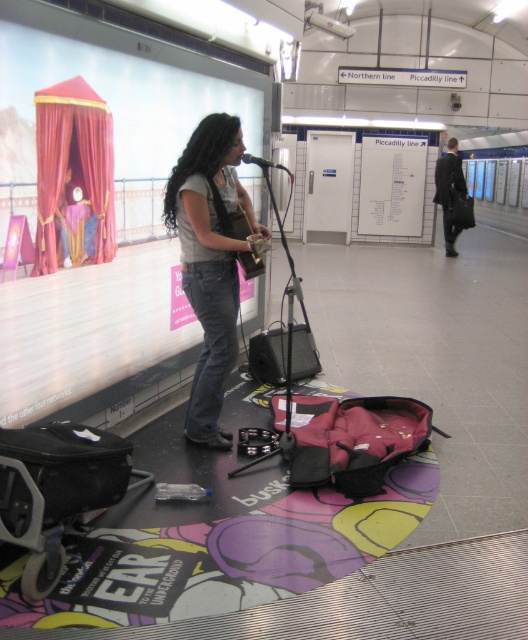
Question: Is the position of dark suit at right more distant than that of black metallic microphone at center?

Choices:
 (A) yes
 (B) no

Answer: (A)

Question: Which object is closer to the camera taking this photo?

Choices:
 (A) black metallic microphone at center
 (B) dark suit at right
 (C) wooden acoustic guitar at center

Answer: (C)

Question: Which is nearer to the black metallic microphone at center?

Choices:
 (A) wooden acoustic guitar at center
 (B) matte gray shirt at center

Answer: (A)

Question: Does matte gray shirt at center have a lesser width compared to dark suit at right?

Choices:
 (A) no
 (B) yes

Answer: (A)

Question: Does wooden acoustic guitar at center have a smaller size compared to black metallic microphone at center?

Choices:
 (A) no
 (B) yes

Answer: (A)

Question: Among these objects, which one is farthest from the camera?

Choices:
 (A) matte gray shirt at center
 (B) dark suit at right

Answer: (B)